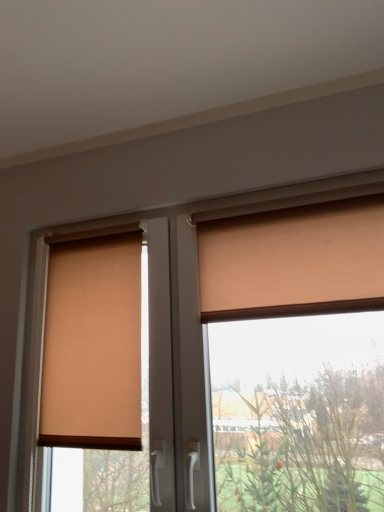
Describe the element at coordinates (162, 303) in the screenshot. I see `matte orange roller blind at center` at that location.

From the picture: Measure the distance between point (168, 409) and camera.

Point (168, 409) is 1.18 meters from camera.

The width and height of the screenshot is (384, 512). What do you see at coordinates (293, 261) in the screenshot?
I see `matte orange curtain at upper right` at bounding box center [293, 261].

This screenshot has height=512, width=384. I want to click on matte beige blind at left, so click(x=93, y=345).

Consider the image. Does matte orange curtain at upper right have a greater height compared to matte orange roller blind at center?

No.

Which object is wider, matte orange curtain at upper right or matte orange roller blind at center?

A: With larger width is matte orange roller blind at center.

What's the angular difference between matte orange curtain at upper right and matte orange roller blind at center's facing directions?

The angular difference between matte orange curtain at upper right and matte orange roller blind at center is 0.519 degrees.

Measure the distance between matte orange curtain at upper right and matte orange roller blind at center.

The distance of matte orange curtain at upper right from matte orange roller blind at center is 6.53 inches.

From the picture: Is the depth of matte orange roller blind at center greater than that of matte orange curtain at upper right?

No, matte orange roller blind at center is closer to the viewer.

From the image's perspective, is matte orange roller blind at center on matte orange curtain at upper right?

No, from the image's perspective, matte orange roller blind at center is not on top of matte orange curtain at upper right.

Find the location of a particular element. The width and height of the screenshot is (384, 512). curtain lying on the right of matte orange roller blind at center is located at coordinates (293, 261).

Which is more to the right, matte orange roller blind at center or matte orange curtain at upper right?

From the viewer's perspective, matte orange curtain at upper right appears more on the right side.

How different are the orientations of matte beige blind at left and matte orange curtain at upper right in degrees?

The angle between the facing direction of matte beige blind at left and the facing direction of matte orange curtain at upper right is 1.29 degrees.

In terms of width, does matte beige blind at left look wider or thinner when compared to matte orange curtain at upper right?

In the image, matte beige blind at left appears to be wider than matte orange curtain at upper right.

Would you say matte beige blind at left is inside or outside matte orange curtain at upper right?

matte beige blind at left exists outside the volume of matte orange curtain at upper right.

Considering the relative positions of matte beige blind at left and matte orange curtain at upper right in the image provided, is matte beige blind at left in front of matte orange curtain at upper right?

No.

From the image's perspective, between matte beige blind at left and matte orange roller blind at center, which one is located above?

matte beige blind at left appears higher in the image.

The width and height of the screenshot is (384, 512). In order to click on window blind behind the matte orange roller blind at center in this screenshot , I will do `click(93, 345)`.

Does point (86, 350) lie behind point (40, 265)?

No.

Considering the sizes of matte orange roller blind at center and matte beige blind at left in the image, is matte orange roller blind at center bigger or smaller than matte beige blind at left?

matte orange roller blind at center is bigger than matte beige blind at left.

From the picture: Considering their positions, is matte orange roller blind at center located in front of or behind matte beige blind at left?

In the image, matte orange roller blind at center appears in front of matte beige blind at left.

In the image, is matte orange roller blind at center on the left side or the right side of matte beige blind at left?

Clearly, matte orange roller blind at center is on the right of matte beige blind at left in the image.

Does matte orange curtain at upper right turn towards matte beige blind at left?

No, matte orange curtain at upper right is not turned towards matte beige blind at left.

Consider the image. Considering the relative positions of matte orange curtain at upper right and matte beige blind at left in the image provided, is matte orange curtain at upper right to the left of matte beige blind at left from the viewer's perspective?

No.

Is matte orange curtain at upper right taller or shorter than matte beige blind at left?

matte orange curtain at upper right is shorter than matte beige blind at left.

Which object is wider, matte orange curtain at upper right or matte beige blind at left?

matte beige blind at left is wider.

Identify the location of window located in front of the matte orange curtain at upper right. click(x=162, y=303).

At what (x,y) coordinates should I click in order to perform the action: click on window that appears below the matte orange curtain at upper right (from a real-world perspective). Please return your answer as a coordinate pair (x, y). Looking at the image, I should click on (162, 303).

When comparing their distances from matte orange roller blind at center, does matte beige blind at left or matte orange curtain at upper right seem further?

Among the two, matte orange curtain at upper right is located further to matte orange roller blind at center.

Estimate the real-world distances between objects in this image. Which object is closer to matte orange curtain at upper right, matte orange roller blind at center or matte beige blind at left?

matte orange roller blind at center.

Considering their positions, is matte orange curtain at upper right positioned further to matte beige blind at left than matte orange roller blind at center?

matte orange curtain at upper right lies further to matte beige blind at left than the other object.

Based on their spatial positions, is matte orange roller blind at center or matte orange curtain at upper right further from matte beige blind at left?

matte orange curtain at upper right is positioned further to the anchor matte beige blind at left.

Estimate the real-world distances between objects in this image. Which object is further from matte orange curtain at upper right, matte beige blind at left or matte orange roller blind at center?

matte beige blind at left is further to matte orange curtain at upper right.

Looking at the image, which one is located further to matte orange roller blind at center, matte orange curtain at upper right or matte beige blind at left?

matte orange curtain at upper right is further to matte orange roller blind at center.

This screenshot has height=512, width=384. Find the location of `window between matte beige blind at left and matte orange curtain at upper right in the horizontal direction`. window between matte beige blind at left and matte orange curtain at upper right in the horizontal direction is located at coordinates (162, 303).